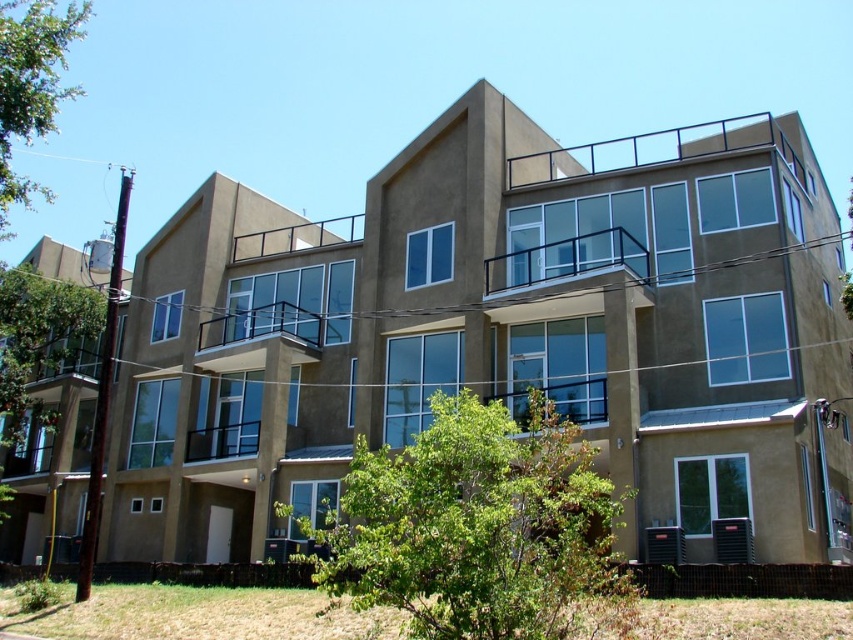
Based on the photo, you are an architect designing a new residential building. You want to ensure that the black metal railing at upper center and the metallic silver balcony at center are proportionate. Which object has a greater width?

The black metal railing at upper center has a greater width than the metallic silver balcony at center.

You are a photographer planning to capture the building from a distance. You want to ensure that the green leafy tree at upper left and the metallic silver balcony at center are both visible in the frame. Based on their sizes, which object will occupy more space in the photo?

The green leafy tree at upper left will occupy more space in the photo because its width is larger than that of the metallic silver balcony at center.